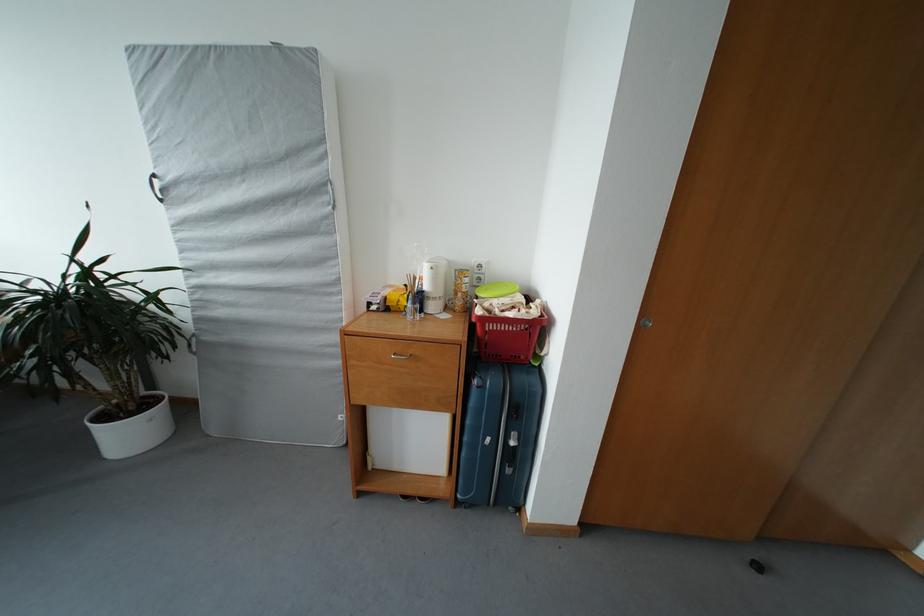
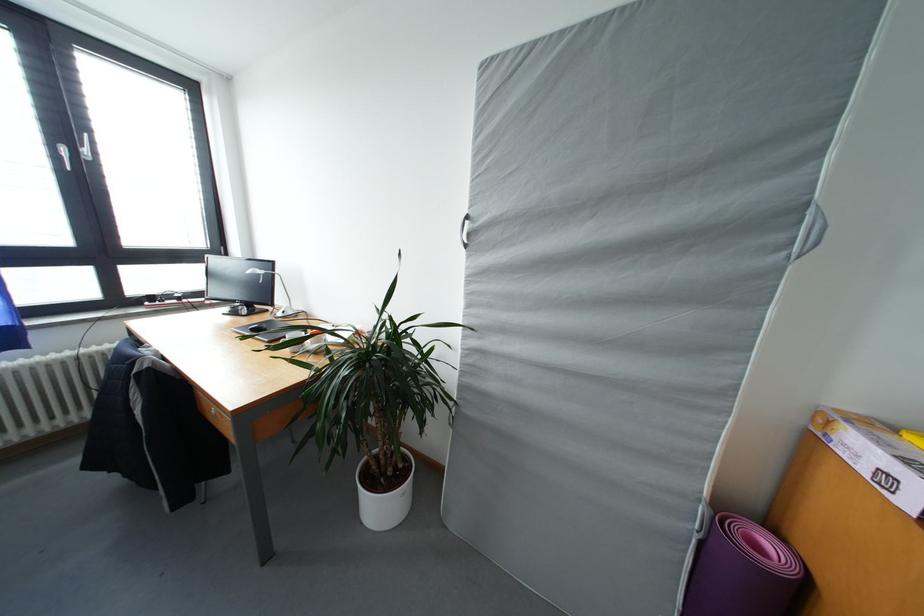
Locate, in the second image, the point that corresponds to pixel 161 180 in the first image.

(473, 222)